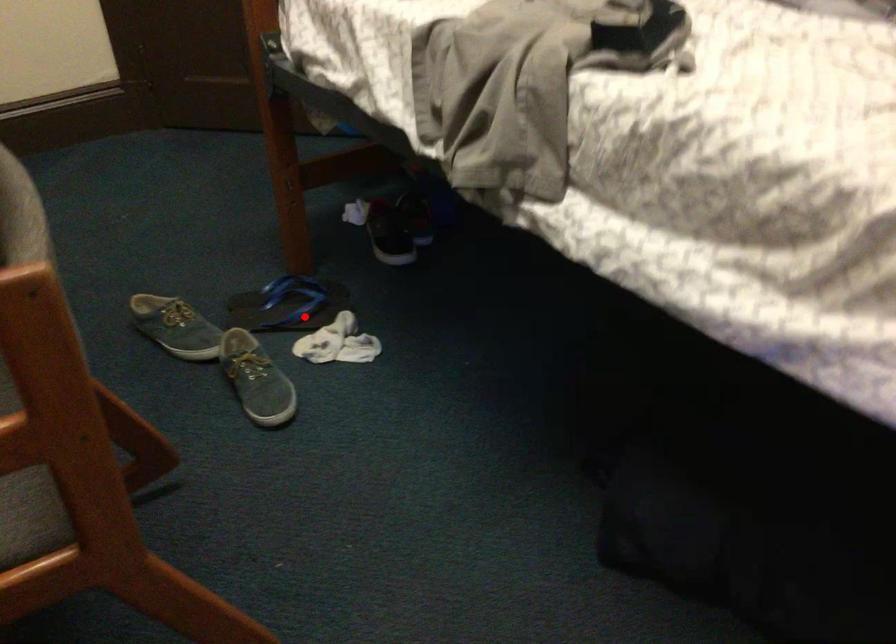
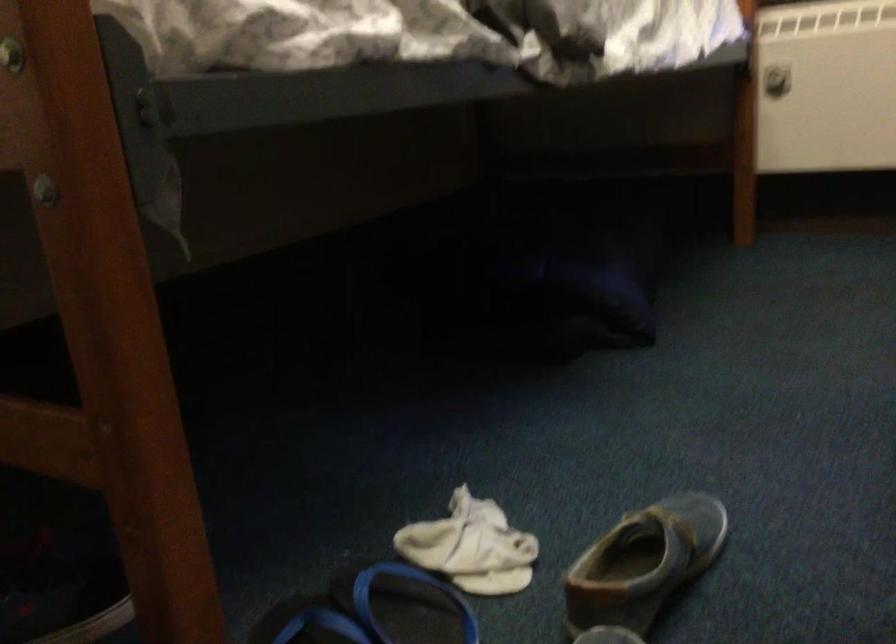
In the second image, find the point that corresponds to the highlighted location in the first image.

(406, 605)